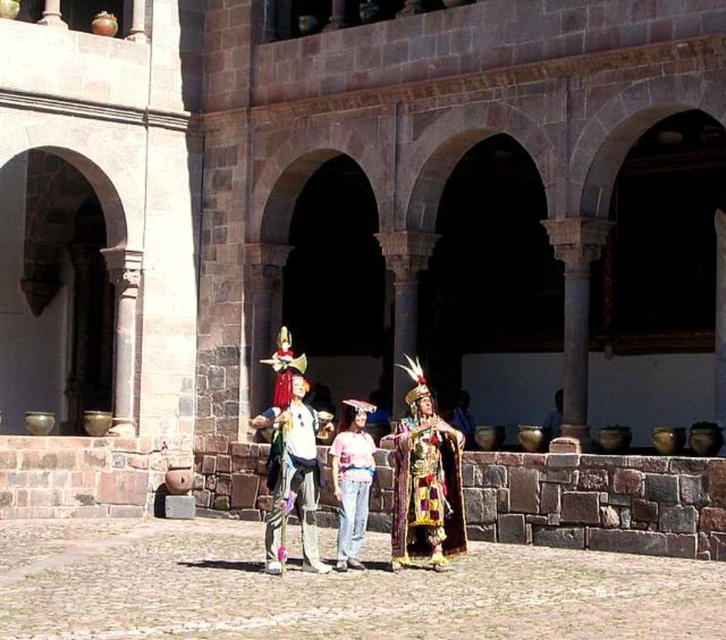
You are a photographer positioned in the courtyard. You want to take a photo that captures both the shiny gold fabric at center and the matte white shirt at center without any obstruction. Based on their positions, which object should you adjust your focus to ensure both are visible clearly?

The matte white shirt at center is behind the shiny gold fabric at center. To ensure both are visible clearly without obstruction, adjust your focus to include both by positioning the shiny gold fabric at center slightly forward or moving the matte white shirt at center backward so they don not block each other.

You are an anthropologist examining the attire of the individuals in the courtyard. The shiny gold fabric at center and the matte white shirt at center are part of the same costume. Which part of the costume is positioned higher?

The shiny gold fabric at center is located above the matte white shirt at center, so the gold fabric is positioned higher in the costume.